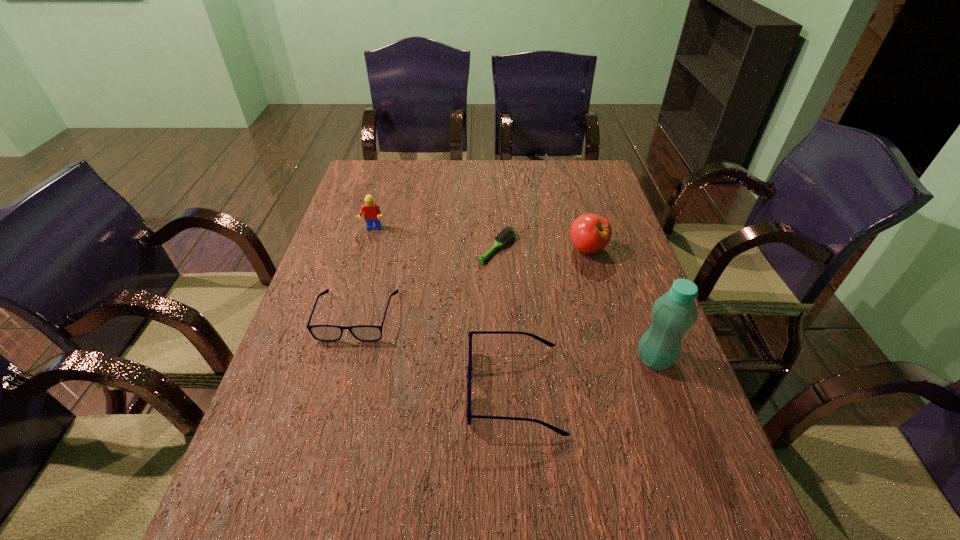
You are a GUI agent. You are given a task and a screenshot of the screen. Output one action in this format:
    pyautogui.click(x=<x>, y=<y>)
    Task: Click on the vacant point located between the fourth tallest object and the apple
    The image size is (960, 540).
    Given the screenshot: What is the action you would take?
    pyautogui.click(x=551, y=319)

Locate an element on the screen. unoccupied area between the apple and the fifth tallest object is located at coordinates (472, 282).

Where is `free spot between the apple and the right spectacles`? The width and height of the screenshot is (960, 540). free spot between the apple and the right spectacles is located at coordinates (551, 319).

The height and width of the screenshot is (540, 960). In order to click on unoccupied area between the third shortest object and the apple in this screenshot , I will do `click(551, 319)`.

At what (x,y) coordinates should I click in order to perform the action: click on empty space between the apple and the left spectacles. Please return your answer as a coordinate pair (x, y). Looking at the image, I should click on (472, 282).

Where is `free spot between the fourth tallest object and the apple`? Image resolution: width=960 pixels, height=540 pixels. free spot between the fourth tallest object and the apple is located at coordinates point(551,319).

The image size is (960, 540). What are the coordinates of `the fourth closest object to the tallest object` in the screenshot? It's located at coord(328,333).

Image resolution: width=960 pixels, height=540 pixels. I want to click on object that can be found as the closest to the water bottle, so click(469, 376).

The width and height of the screenshot is (960, 540). Identify the location of free space that satisfies the following two spatial constraints: 1. at the front cap of the water bottle; 2. on the front-facing side of the nearer spectacles. (665, 389).

The image size is (960, 540). Identify the location of free spot that satisfies the following two spatial constraints: 1. on the front-facing side of the Lego; 2. on the right side of the apple. (367, 249).